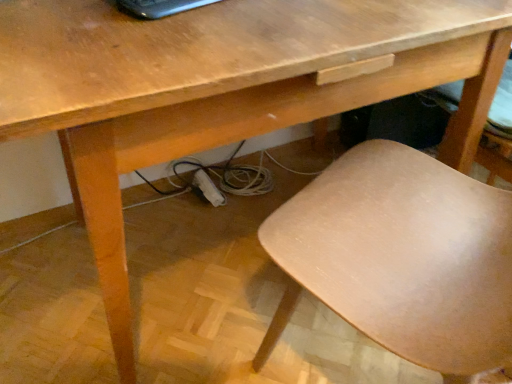
Question: Can you confirm if light brown wood chair at lower right is bigger than black glossy laptop at upper center?

Choices:
 (A) no
 (B) yes

Answer: (B)

Question: Can you confirm if light brown wood chair at lower right is shorter than black glossy laptop at upper center?

Choices:
 (A) yes
 (B) no

Answer: (B)

Question: Is light brown wood chair at lower right further to the viewer compared to black glossy laptop at upper center?

Choices:
 (A) no
 (B) yes

Answer: (A)

Question: Considering the relative sizes of light brown wood chair at lower right and black glossy laptop at upper center in the image provided, is light brown wood chair at lower right smaller than black glossy laptop at upper center?

Choices:
 (A) no
 (B) yes

Answer: (A)

Question: Can you confirm if light brown wood chair at lower right is wider than black glossy laptop at upper center?

Choices:
 (A) no
 (B) yes

Answer: (B)

Question: Considering the relative sizes of light brown wood chair at lower right and black glossy laptop at upper center in the image provided, is light brown wood chair at lower right thinner than black glossy laptop at upper center?

Choices:
 (A) yes
 (B) no

Answer: (B)

Question: From the image's perspective, would you say black glossy laptop at upper center is positioned over light brown wood chair at lower right?

Choices:
 (A) yes
 (B) no

Answer: (A)

Question: From a real-world perspective, does black glossy laptop at upper center stand above light brown wood chair at lower right?

Choices:
 (A) yes
 (B) no

Answer: (A)

Question: Does black glossy laptop at upper center touch light brown wood chair at lower right?

Choices:
 (A) no
 (B) yes

Answer: (A)

Question: Does black glossy laptop at upper center contain light brown wood chair at lower right?

Choices:
 (A) yes
 (B) no

Answer: (B)

Question: Is black glossy laptop at upper center bigger than light brown wood chair at lower right?

Choices:
 (A) no
 (B) yes

Answer: (A)

Question: Is black glossy laptop at upper center further to camera compared to light brown wood chair at lower right?

Choices:
 (A) no
 (B) yes

Answer: (B)

Question: From the image's perspective, is black glossy laptop at upper center above or below light brown wood chair at lower right?

Choices:
 (A) below
 (B) above

Answer: (B)